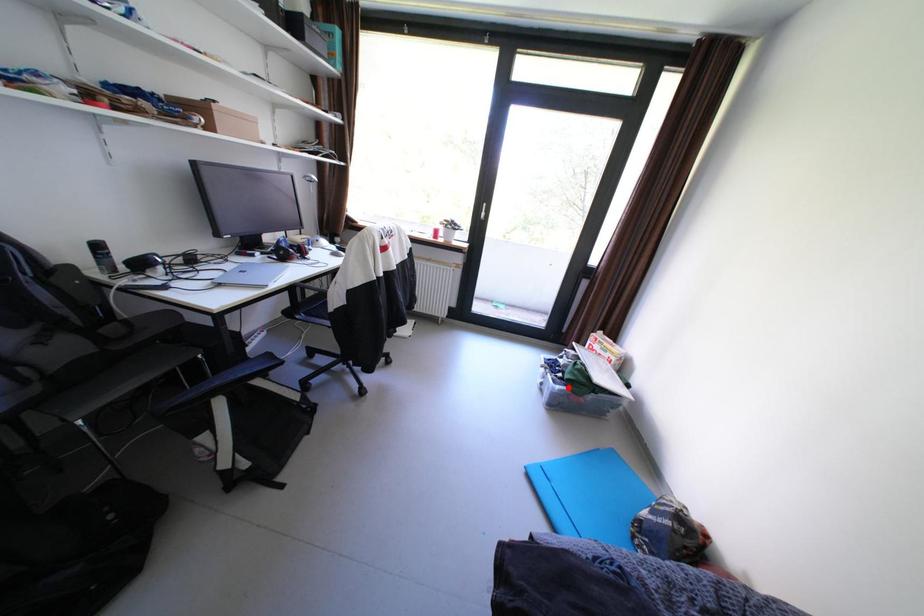
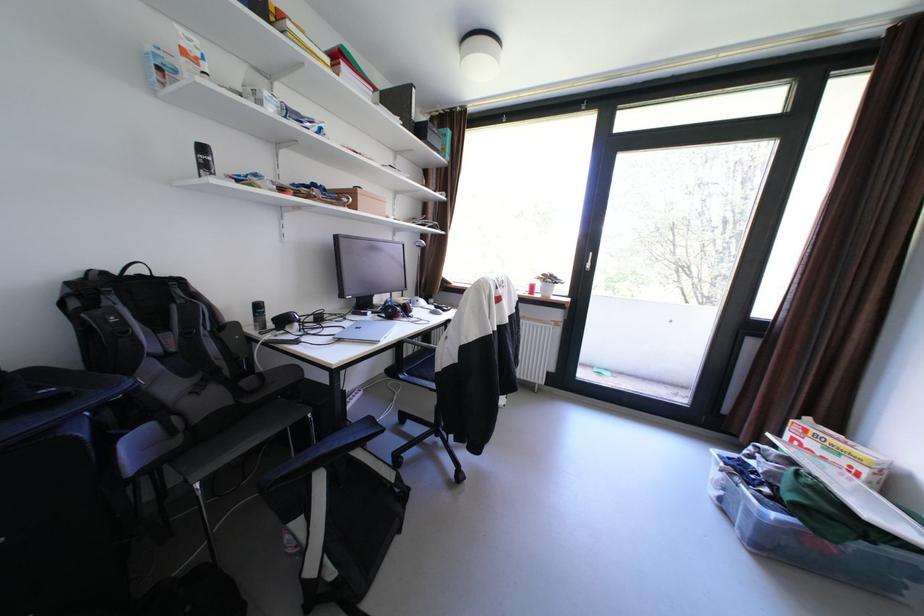
Find the pixel in the second image that matches the highlighted location in the first image.

(784, 516)